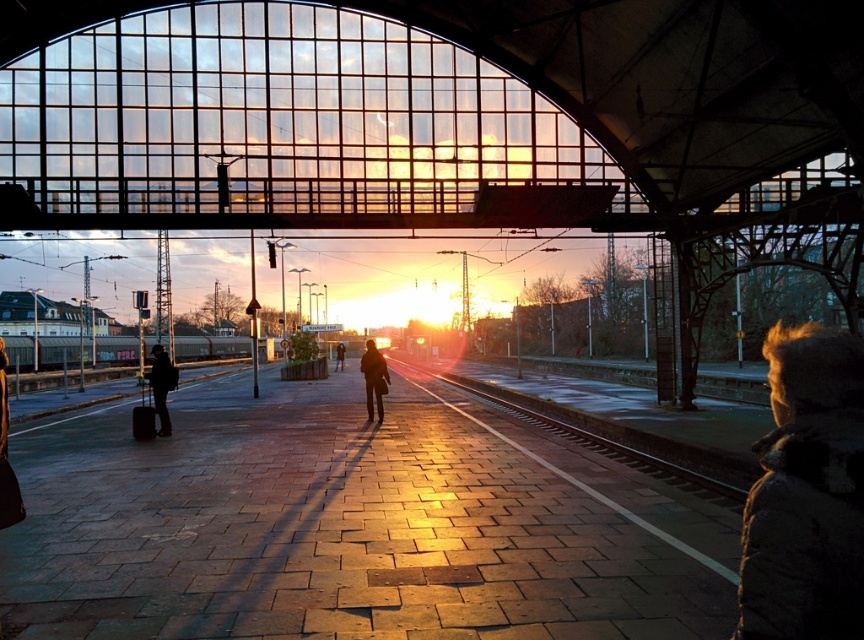
You are a photographer standing on the train station platform. You want to take a photo of the dark fuzzy jacket at lower right and the matte black suitcase at left. Which object will appear bigger in your photo?

The dark fuzzy jacket at lower right will appear bigger in the photo because it is larger in size than the matte black suitcase at left.

Consider the image. You are standing at point (725, 504) and want to walk to the edge of the platform. The platform is 12 meters long. Can you reach the edge without walking more than 3 meters?

The distance between you and the edge of the platform is 9.37 meters, which is more than 3 meters, so you cannot reach it without walking more than 3 meters.